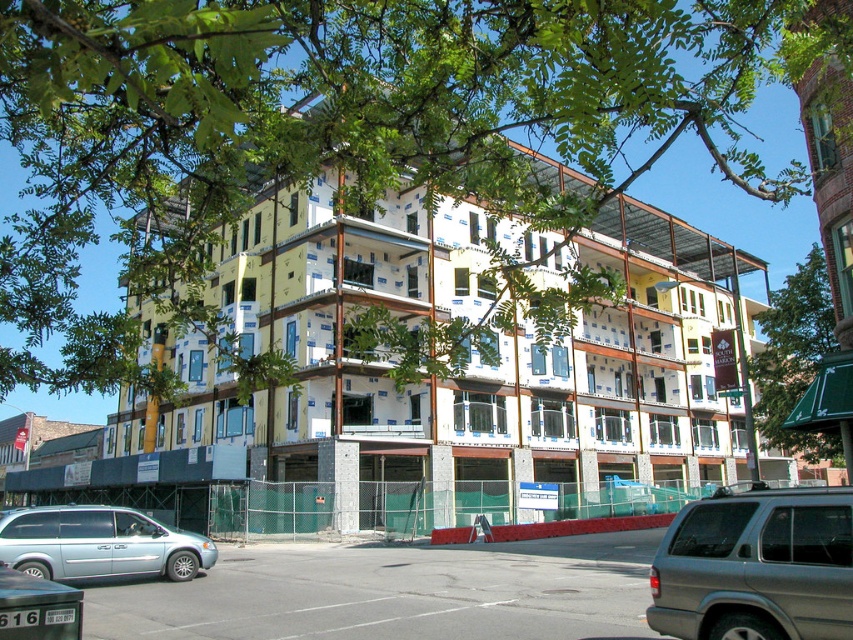
Which of these two, yellow/white siding building at center or matte silver minivan at lower left, stands shorter?

matte silver minivan at lower left is shorter.

Can you confirm if yellow/white siding building at center is smaller than matte silver minivan at lower left?

No.

Is point (546, 458) positioned before point (107, 548)?

No, it is behind (107, 548).

This screenshot has width=853, height=640. In order to click on yellow/white siding building at center in this screenshot , I will do `click(497, 349)`.

Which is in front, point (622, 365) or point (799, 294)?

Point (799, 294) is in front.

Is yellow/white siding building at center wider than green leafy tree at upper center?

Incorrect, yellow/white siding building at center's width does not surpass green leafy tree at upper center's.

Is point (527, 353) less distant than point (799, 301)?

That is False.

Image resolution: width=853 pixels, height=640 pixels. What are the coordinates of `yellow/white siding building at center` in the screenshot? It's located at (497, 349).

Can you confirm if yellow/white siding building at center is taller than silver metallic suv at lower right?

Indeed, yellow/white siding building at center has a greater height compared to silver metallic suv at lower right.

Identify the location of yellow/white siding building at center. The image size is (853, 640). (497, 349).

Is point (297, 515) farther from viewer compared to point (819, 556)?

Yes, point (297, 515) is farther from viewer.

Find the location of a particular element. yellow/white siding building at center is located at coordinates (497, 349).